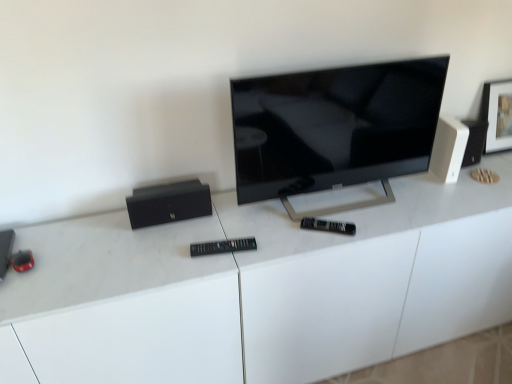
Locate an element on the screen. The width and height of the screenshot is (512, 384). free area in between black matte speaker at left, positioned as the 2th speaker in right-to-left order, and black plastic remote at center is located at coordinates (196, 237).